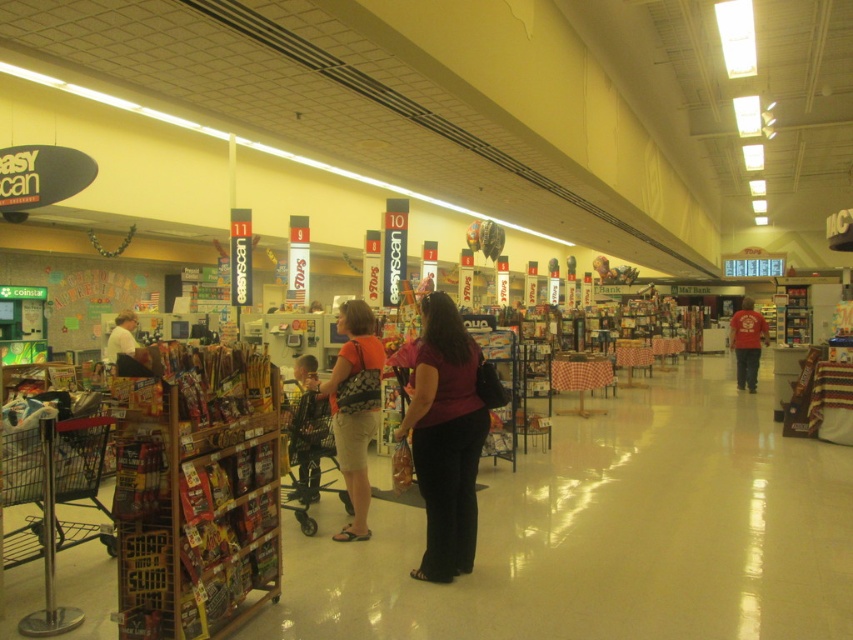
You are a customer in the store and want to place the red cotton shirt at right into the metallic gray shopping cart at center. Can you fit the shirt into the cart based on their sizes?

The metallic gray shopping cart at center has a width that is less than the red cotton shirt at right, so the shirt may not fit into the cart.